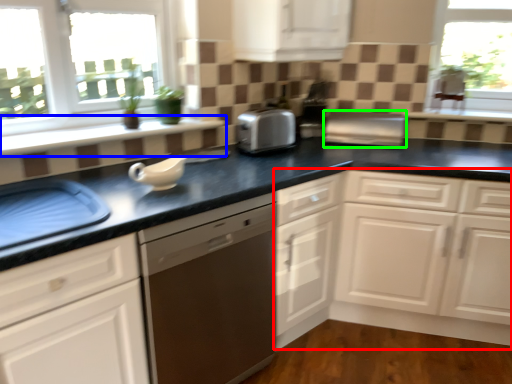
Question: Which object is the farthest from cabinetry (highlighted by a red box)? Choose among these: window sill (highlighted by a blue box) or appliance (highlighted by a green box).

Choices:
 (A) window sill
 (B) appliance

Answer: (A)